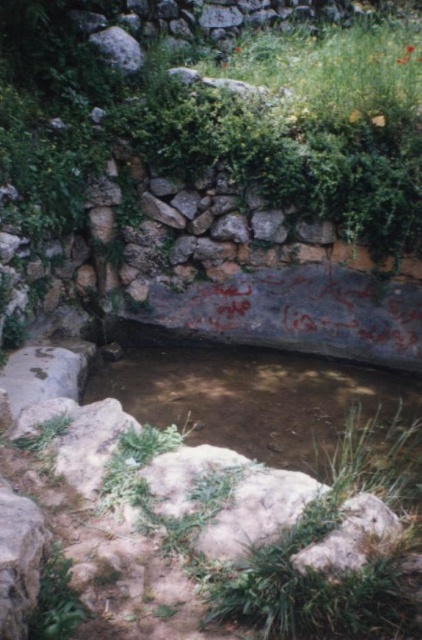
You are standing at the edge of the water feature and notice two points marked in the image. From your perspective, which point is closer to you, point (186,144) or point (110,372)?

Point (186,144) is in front of point (110,372), so it is closer to you.